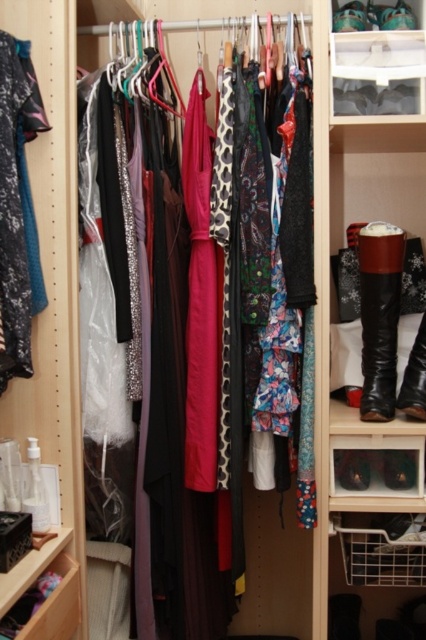
Question: Does shiny black leather boot at right appear on the right side of leather boots at right?

Choices:
 (A) no
 (B) yes

Answer: (A)

Question: Can you confirm if velvet teal dress at left is positioned above leather boots at right?

Choices:
 (A) no
 (B) yes

Answer: (B)

Question: Which object is positioned closest to the clear plastic shoebox at upper center?

Choices:
 (A) velvet teal dress at left
 (B) leather boots at right
 (C) brushed metal drawer at lower left

Answer: (B)

Question: Can you confirm if shiny black leather boot at right is positioned to the left of brushed metal drawer at lower left?

Choices:
 (A) no
 (B) yes

Answer: (A)

Question: Which object is the farthest from the clear plastic shoebox at upper center?

Choices:
 (A) shiny black leather boot at right
 (B) velvet teal dress at left

Answer: (B)

Question: Which point is closer to the camera?

Choices:
 (A) clear plastic shoebox at upper center
 (B) shiny black leather boot at right
 (C) leather boots at right

Answer: (A)